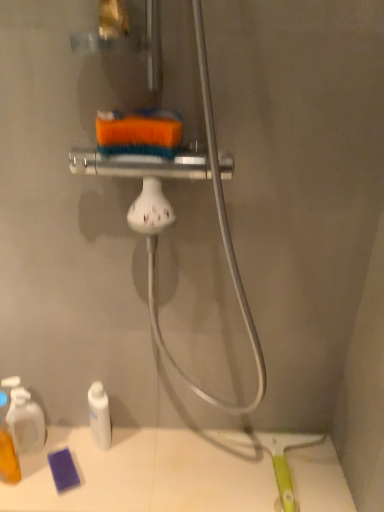
Where is `free space in front of white matte bottle at lower left, which is the 3th toiletry from left to right`? free space in front of white matte bottle at lower left, which is the 3th toiletry from left to right is located at coordinates (89, 485).